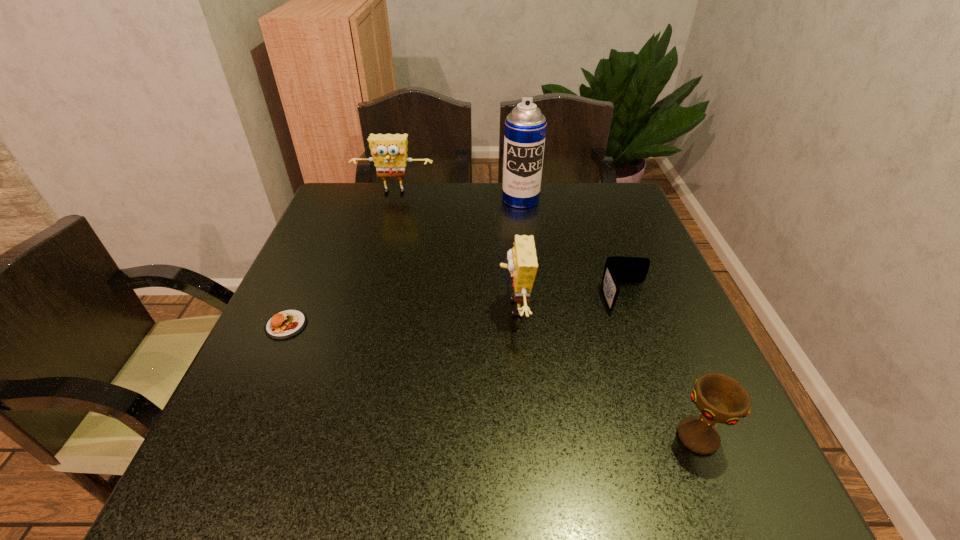
Select which object appears as the closest to the shortest object. Please provide its 2D coordinates. Your answer should be formatted as a tuple, i.e. [(x, y)], where the tuple contains the x and y coordinates of a point satisfying the conditions above.

[(522, 261)]

Locate an element on the screen. This screenshot has height=540, width=960. vacant region that satisfies the following two spatial constraints: 1. on the face of the nearer sponge; 2. on the right side of the nearest object is located at coordinates (525, 437).

Find the location of a particular element. free space that satisfies the following two spatial constraints: 1. on the face of the nearer sponge; 2. on the front side of the shortest object is located at coordinates (516, 325).

In order to click on free space that satisfies the following two spatial constraints: 1. on the outer surface of the second shortest object; 2. on the face of the nearer sponge in this screenshot , I will do `click(631, 308)`.

Locate an element on the screen. This screenshot has width=960, height=540. vacant space that satisfies the following two spatial constraints: 1. on the outer surface of the chalice; 2. on the left side of the wallet is located at coordinates (677, 437).

The height and width of the screenshot is (540, 960). What are the coordinates of `free location that satisfies the following two spatial constraints: 1. on the label side of the tallest object; 2. on the face of the nearer sponge` in the screenshot? It's located at (535, 308).

The width and height of the screenshot is (960, 540). I want to click on free space that satisfies the following two spatial constraints: 1. on the outer surface of the second shortest object; 2. on the left side of the chalice, so click(x=677, y=437).

I want to click on free point that satisfies the following two spatial constraints: 1. on the outer surface of the wallet; 2. on the face of the right sponge, so click(631, 308).